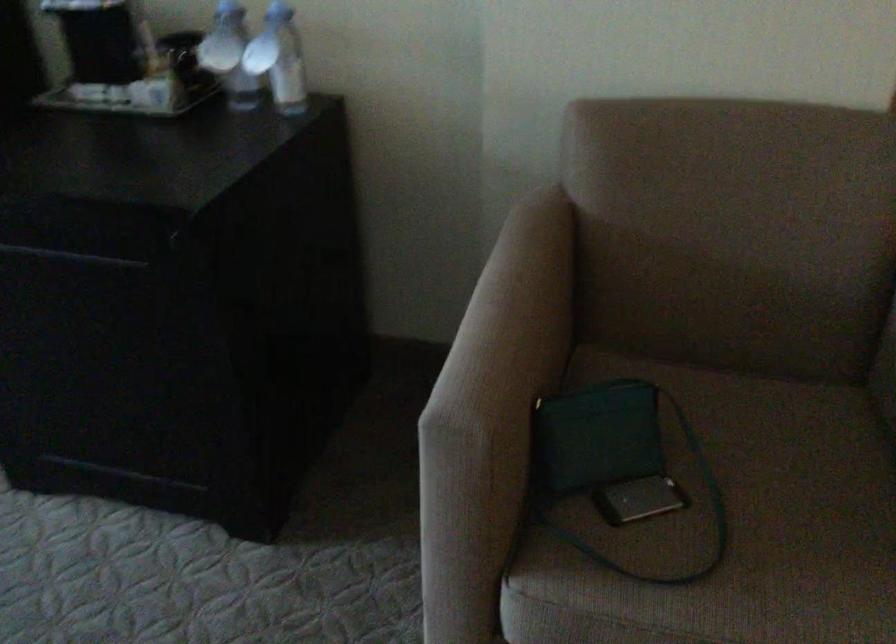
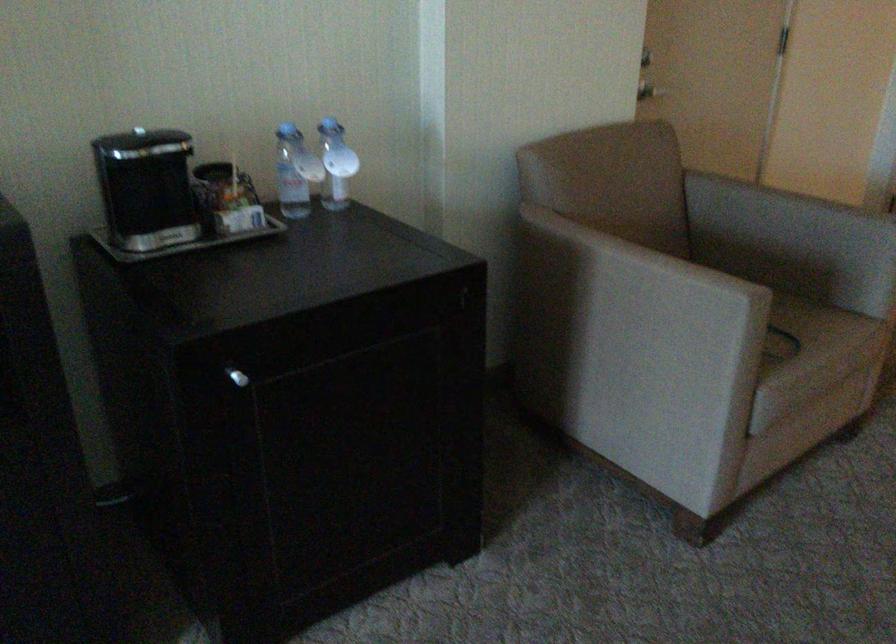
Question: I am providing you with two images of the same scene from different viewpoints. After the viewpoint changes to image2, which objects are now occluded?

Choices:
 (A) green handbag
 (B) grey bed pillow
 (C) metal door handle
 (D) chair sitting surface

Answer: (A)